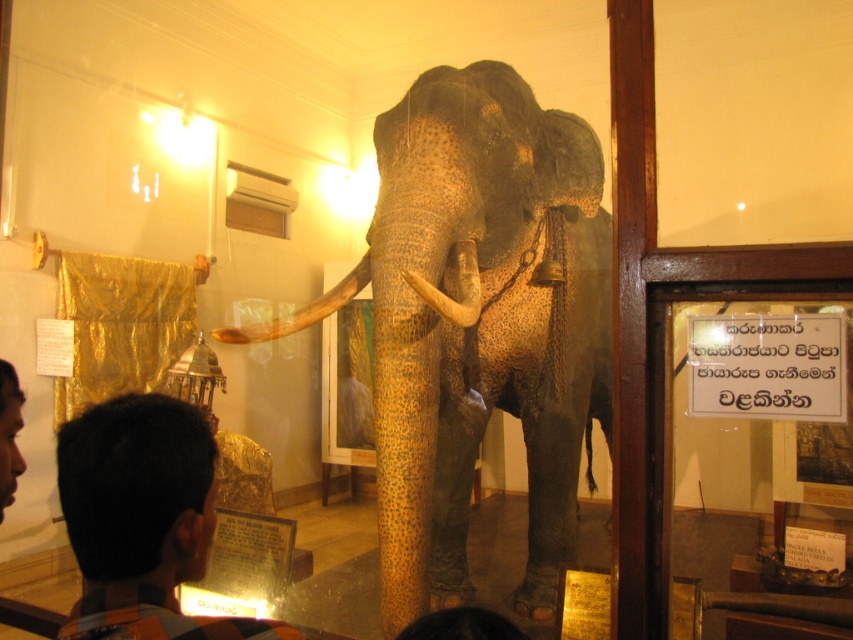
Who is more forward, [173,608] or [322,305]?

Point [173,608] is more forward.

Is point (68, 472) more distant than point (297, 310)?

No, it is in front of (297, 310).

The height and width of the screenshot is (640, 853). Identify the location of brown hair at lower left. (143, 520).

Measure the distance from brown hair at lower left to white ivory tusk at center.

1.05 meters

Can you confirm if brown hair at lower left is smaller than white ivory tusk at center?

Correct, brown hair at lower left occupies less space than white ivory tusk at center.

Does point (206, 628) come closer to viewer compared to point (459, 273)?

Yes, it is.

Image resolution: width=853 pixels, height=640 pixels. Find the location of `brown hair at lower left`. brown hair at lower left is located at coordinates click(x=143, y=520).

The height and width of the screenshot is (640, 853). What do you see at coordinates (479, 324) in the screenshot?
I see `spotted brown elephant at center` at bounding box center [479, 324].

Can you confirm if spotted brown elephant at center is shorter than brown hair at lower left?

Incorrect, spotted brown elephant at center's height does not fall short of brown hair at lower left's.

Does point (421, 387) come in front of point (187, 412)?

No.

Identify the location of spotted brown elephant at center. The width and height of the screenshot is (853, 640). (479, 324).